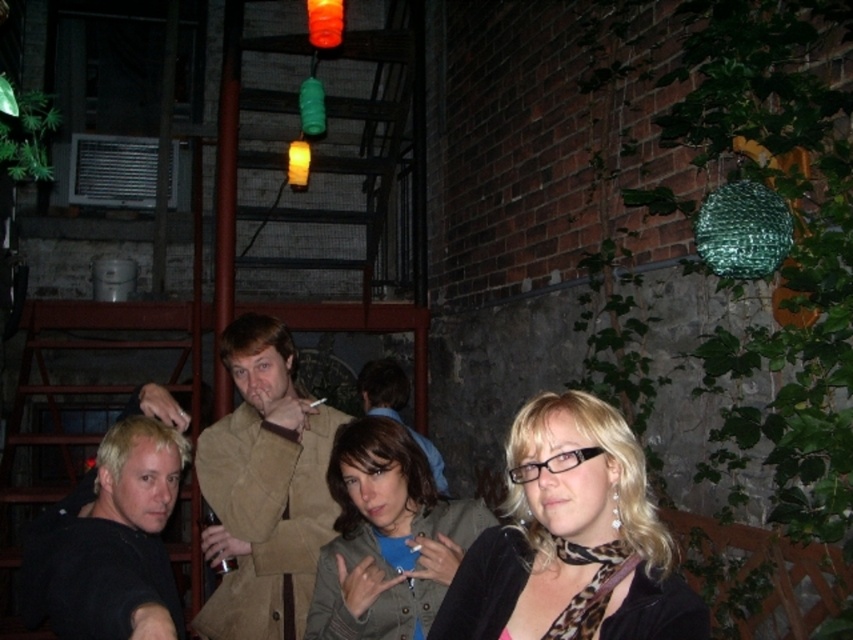
Is green fabric jacket at center wider than black matte shirt at lower left?

Incorrect, green fabric jacket at center's width does not surpass black matte shirt at lower left's.

Can you confirm if green fabric jacket at center is thinner than black matte shirt at lower left?

Indeed, green fabric jacket at center has a lesser width compared to black matte shirt at lower left.

At what (x,y) coordinates should I click in order to perform the action: click on green fabric jacket at center. Please return your answer as a coordinate pair (x, y). Image resolution: width=853 pixels, height=640 pixels. Looking at the image, I should click on (386, 538).

You are a GUI agent. You are given a task and a screenshot of the screen. Output one action in this format:
    pyautogui.click(x=<x>, y=<y>)
    Task: Click on the green fabric jacket at center
    This screenshot has height=640, width=853.
    Given the screenshot: What is the action you would take?
    pyautogui.click(x=386, y=538)

Does green fabric jacket at center have a greater width compared to light brown leather jacket at center?

Correct, the width of green fabric jacket at center exceeds that of light brown leather jacket at center.

Is green fabric jacket at center positioned before light brown leather jacket at center?

Yes, it is in front of light brown leather jacket at center.

Which is in front, point (486, 512) or point (373, 410)?

Point (486, 512) is more forward.

This screenshot has width=853, height=640. What are the coordinates of `green fabric jacket at center` in the screenshot? It's located at (386, 538).

Between black matte jacket at center and tan suede coat at center, which one has less height?

black matte jacket at center is shorter.

Between black matte jacket at center and tan suede coat at center, which one has more height?

tan suede coat at center is taller.

Locate an element on the screen. Image resolution: width=853 pixels, height=640 pixels. black matte jacket at center is located at coordinates (572, 540).

Where is `black matte jacket at center`? This screenshot has height=640, width=853. black matte jacket at center is located at coordinates (572, 540).